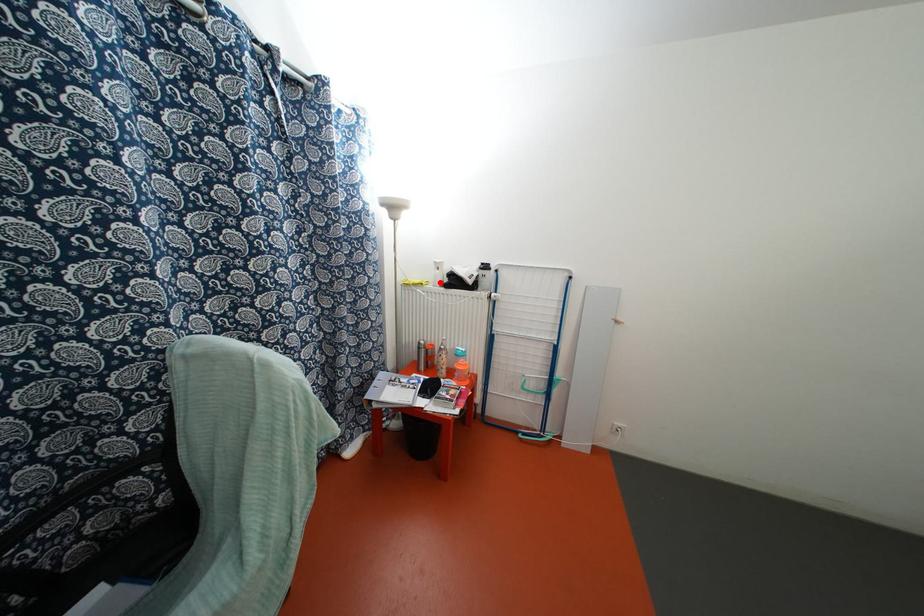
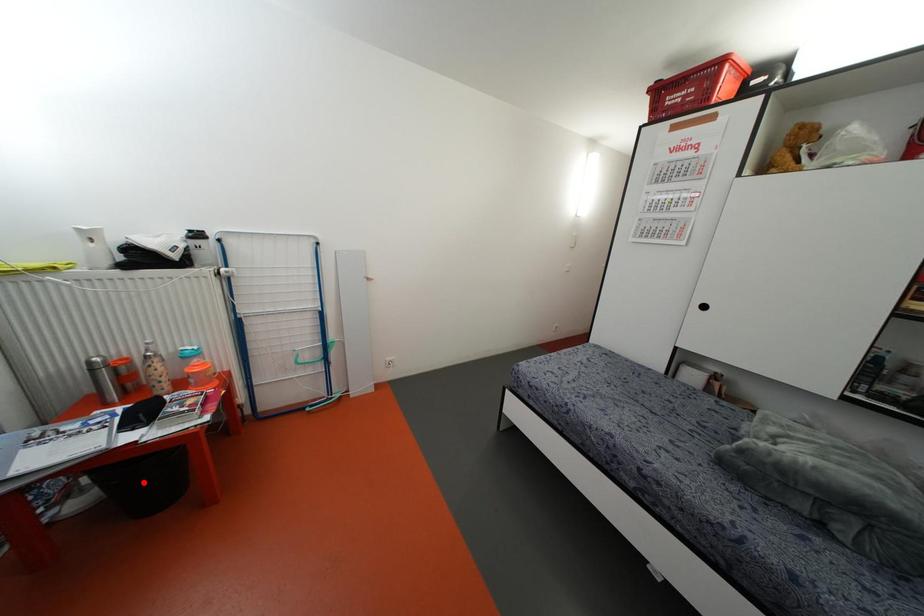
I am providing you with two images of the same scene from different viewpoints. A red point is marked on the first image and another point is marked on the second image. Do the highlighted points in image1 and image2 indicate the same real-world spot?

No